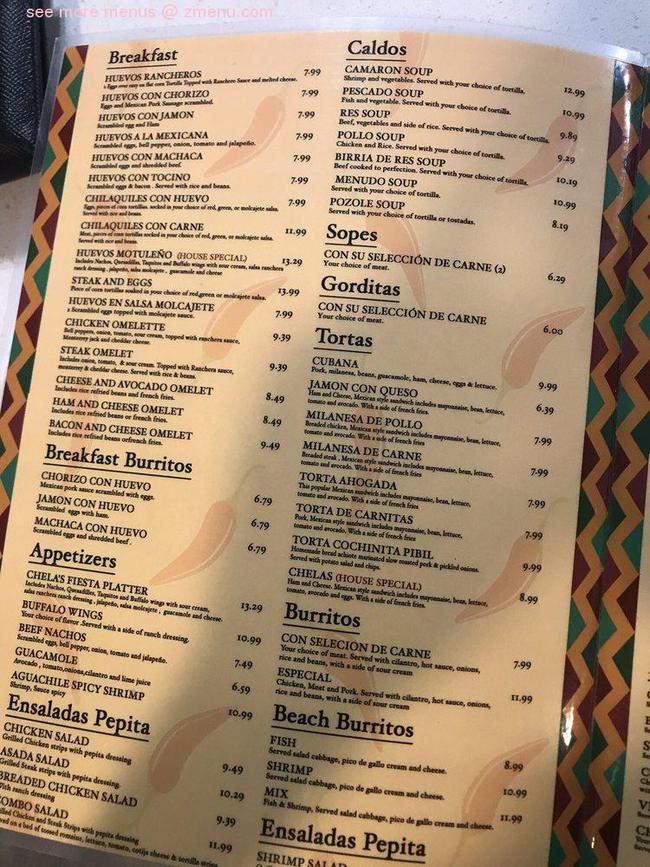
This screenshot has height=867, width=650. I want to click on breakfast section, so click(145, 56).